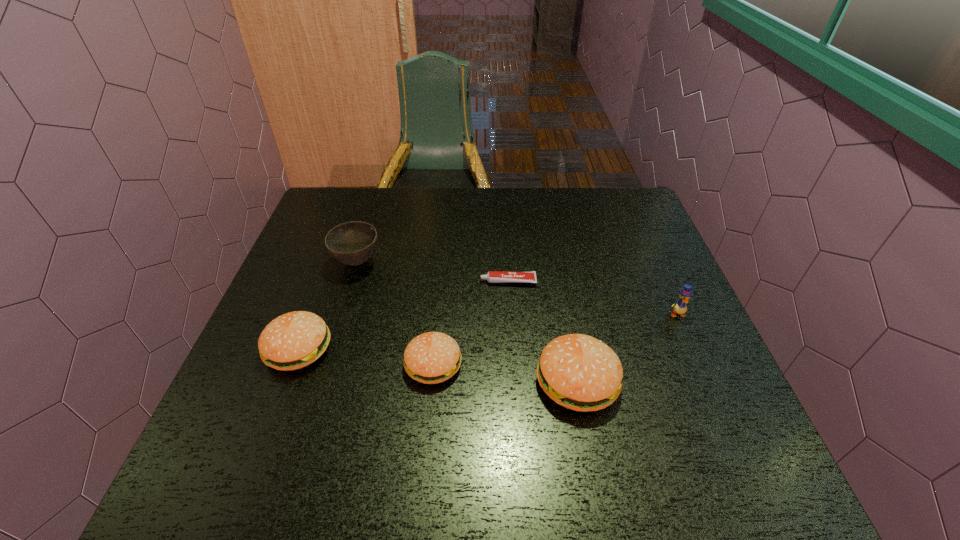
Find the location of a particular element. vacant space located 0.130m on the left of the fourth object from right to left is located at coordinates (346, 364).

In order to click on free region located on the back of the rightmost patty in this screenshot , I will do `click(560, 289)`.

Identify the location of vacant area situated 0.080m on the face of the rightmost object, where the monocle is placed. This screenshot has width=960, height=540. [x=690, y=346].

This screenshot has width=960, height=540. What are the coordinates of `free space located on the right of the bowl` in the screenshot? It's located at (524, 262).

I want to click on free location located 0.350m at the nozzle of the toothpaste, so click(x=347, y=281).

Locate an element on the screen. This screenshot has width=960, height=540. free space located 0.060m at the nozzle of the toothpaste is located at coordinates (457, 281).

Locate an element on the screen. free space located at the nozzle of the toothpaste is located at coordinates (461, 281).

Identify the location of object that is at the near edge. The height and width of the screenshot is (540, 960). (579, 372).

You are a GUI agent. You are given a task and a screenshot of the screen. Output one action in this format:
    pyautogui.click(x=<x>, y=<y>)
    Task: Click on the patty present at the left edge
    The width and height of the screenshot is (960, 540).
    Given the screenshot: What is the action you would take?
    pyautogui.click(x=294, y=340)

Locate an element on the screen. The height and width of the screenshot is (540, 960). bowl positioned at the left edge is located at coordinates (x=352, y=243).